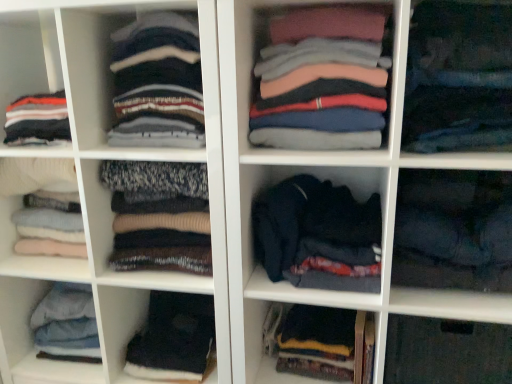
Question: Can we say dark blue fabric at lower right, which ranks as the ninth clothing in left-to-right order, lies outside dark blue sweater at center?

Choices:
 (A) yes
 (B) no

Answer: (A)

Question: Can you confirm if dark blue fabric at lower right, which ranks as the ninth clothing in left-to-right order, is wider than dark blue sweater at center?

Choices:
 (A) yes
 (B) no

Answer: (B)

Question: Considering the relative sizes of dark blue fabric at lower right, which ranks as the ninth clothing in left-to-right order, and dark blue sweater at center in the image provided, is dark blue fabric at lower right, which ranks as the ninth clothing in left-to-right order, taller than dark blue sweater at center?

Choices:
 (A) no
 (B) yes

Answer: (A)

Question: From the image's perspective, is dark blue fabric at lower right, which ranks as the ninth clothing in left-to-right order, below dark blue sweater at center?

Choices:
 (A) yes
 (B) no

Answer: (B)

Question: Is the depth of dark blue fabric at lower right, which ranks as the ninth clothing in left-to-right order, less than that of dark blue sweater at center?

Choices:
 (A) yes
 (B) no

Answer: (A)

Question: Looking at their shapes, would you say dark blue fabric at lower center, acting as the fourth clothing starting from the right, is wider or thinner than knit sweater at center, arranged as the 3th clothing when viewed from the left?

Choices:
 (A) thin
 (B) wide

Answer: (B)

Question: Considering the positions of dark blue fabric at lower center, acting as the fourth clothing starting from the right, and knit sweater at center, arranged as the 3th clothing when viewed from the left, in the image, is dark blue fabric at lower center, acting as the fourth clothing starting from the right, bigger or smaller than knit sweater at center, arranged as the 3th clothing when viewed from the left,?

Choices:
 (A) small
 (B) big

Answer: (A)

Question: From the image's perspective, is dark blue fabric at lower center, which is the 6th clothing in left-to-right order, positioned above or below knit sweater at center, arranged as the 3th clothing when viewed from the left?

Choices:
 (A) above
 (B) below

Answer: (B)

Question: Is dark blue fabric at lower center, which is the 6th clothing in left-to-right order, to the left or to the right of knit sweater at center, acting as the seventh clothing starting from the right, in the image?

Choices:
 (A) left
 (B) right

Answer: (B)

Question: Is point (323, 46) positioned closer to the camera than point (146, 375)?

Choices:
 (A) farther
 (B) closer

Answer: (B)

Question: Considering their positions, is pink cotton shirts at center, the fifth clothing viewed from the left, located in front of or behind black fabric at lower left, arranged as the sixth clothing when viewed from the right?

Choices:
 (A) behind
 (B) front

Answer: (B)

Question: Based on their sizes in the image, would you say pink cotton shirts at center, the fifth clothing viewed from the left, is bigger or smaller than black fabric at lower left, positioned as the fourth clothing in left-to-right order?

Choices:
 (A) big
 (B) small

Answer: (A)

Question: Visually, is pink cotton shirts at center, the fifth clothing viewed from the left, positioned to the left or to the right of black fabric at lower left, arranged as the sixth clothing when viewed from the right?

Choices:
 (A) right
 (B) left

Answer: (A)

Question: Is pink cotton shirts at center, which is the fifth clothing from right to left, in front of or behind knit sweater at left, which is the 1th clothing from left to right, in the image?

Choices:
 (A) behind
 (B) front

Answer: (B)

Question: Is pink cotton shirts at center, which is the fifth clothing from right to left, taller or shorter than knit sweater at left, the ninth clothing in the right-to-left sequence?

Choices:
 (A) short
 (B) tall

Answer: (B)